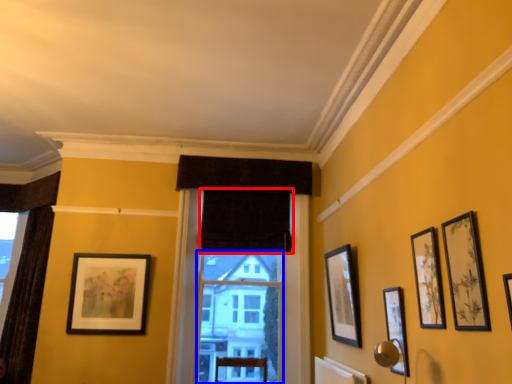
Question: Which object is closer to the camera taking this photo, curtain (highlighted by a red box) or bay window (highlighted by a blue box)?

Choices:
 (A) curtain
 (B) bay window

Answer: (B)